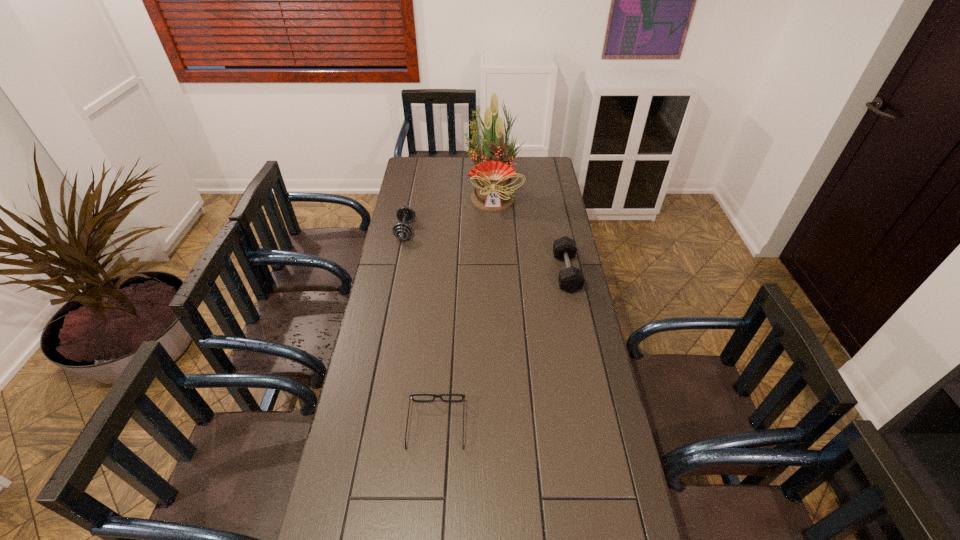
Identify the location of free space between the rightmost object and the second shortest object. (486, 252).

Image resolution: width=960 pixels, height=540 pixels. I want to click on object that can be found as the third closest to the spectacles, so click(492, 192).

Point out which object is positioned as the second nearest to the second nearest object. Please provide its 2D coordinates. Your answer should be formatted as a tuple, i.e. [(x, y)], where the tuple contains the x and y coordinates of a point satisfying the conditions above.

[(462, 395)]

Where is `free space that satisfies the following two spatial constraints: 1. on the front side of the nearer dumbbell; 2. on the left side of the third nearest object`? free space that satisfies the following two spatial constraints: 1. on the front side of the nearer dumbbell; 2. on the left side of the third nearest object is located at coordinates tap(397, 273).

Find the location of `vacant area in the image that satisfies the following two spatial constraints: 1. in front of the flower arrangement with the fan visible; 2. on the right side of the rightmost object`. vacant area in the image that satisfies the following two spatial constraints: 1. in front of the flower arrangement with the fan visible; 2. on the right side of the rightmost object is located at coordinates (496, 273).

At what (x,y) coordinates should I click in order to perform the action: click on vacant point that satisfies the following two spatial constraints: 1. on the front-facing side of the spectacles; 2. on the right side of the right dumbbell. Please return your answer as a coordinate pair (x, y). Looking at the image, I should click on (448, 273).